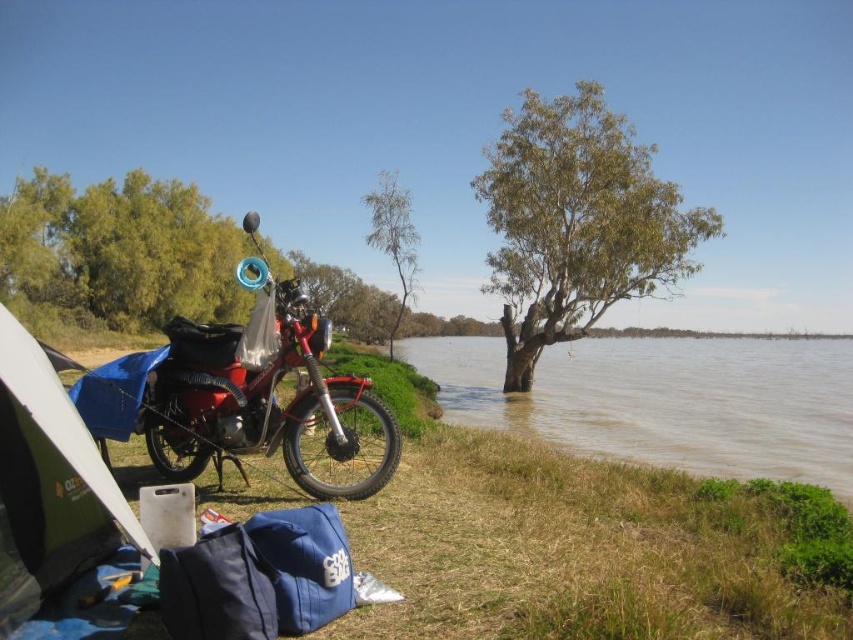
You are planning to cross the brown muddy water at lower center with your shiny red motorcycle at center. Can the motorcycle safely pass through the water if the motorcycle requires a path at least as wide as itself?

The brown muddy water at lower center is wider than the shiny red motorcycle at center, so yes, the motorcycle can safely pass through the water since the path is wider than the motorcycle itself.

You are a hiker who wants to cross the river using the roots of the green leafy tree at center. The shiny red motorcycle at center is blocking your path. Can you move the motorcycle to get to the tree?

The green leafy tree at center is further to the viewer than the shiny red motorcycle at center, meaning the motorcycle is closer to you. Since the motorcycle is blocking your path, you would need to move it to access the tree.